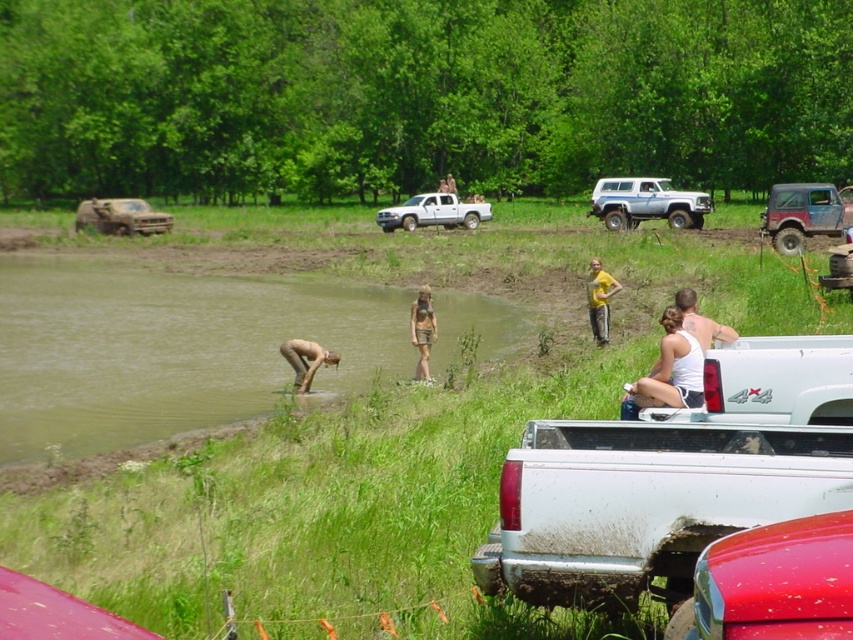
Question: Does white matte truck at center appear under white tank top at upper right?

Choices:
 (A) no
 (B) yes

Answer: (A)

Question: Does white tank top at center have a lesser width compared to brushed metal truck at left?

Choices:
 (A) no
 (B) yes

Answer: (B)

Question: Which object is farther from the camera taking this photo?

Choices:
 (A) smooth skin person at lower center
 (B) tan fabric shorts at center
 (C) white matte truck at center
 (D) silver metallic suv at upper center

Answer: (C)

Question: Estimate the real-world distances between objects in this image. Which object is farther from the yellow fabric pants at center?

Choices:
 (A) silver metallic suv at upper center
 (B) white tank top at upper right
 (C) smooth skin person at lower center
 (D) brushed metal truck at left

Answer: (D)

Question: Is shiny red car at lower right thinner than smooth skin person at lower center?

Choices:
 (A) yes
 (B) no

Answer: (A)

Question: Which of the following is the farthest from the observer?

Choices:
 (A) white tank top at center
 (B) silver metallic suv at upper center
 (C) white matte truck at lower right
 (D) brushed metal truck at left

Answer: (D)